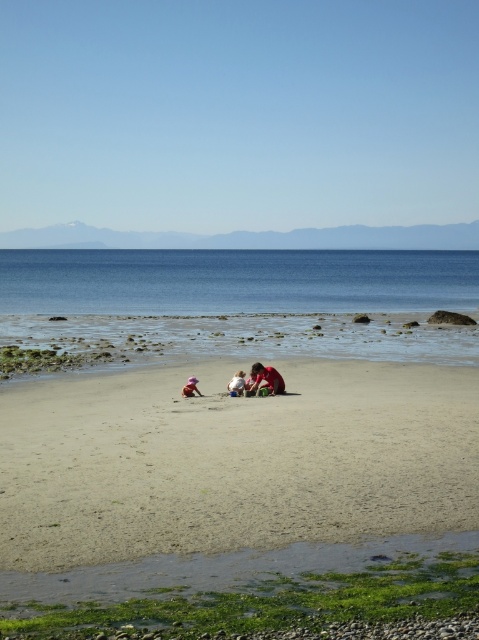
Between light brown sand at center and matte red shirt at center, which one appears on the left side from the viewer's perspective?

From the viewer's perspective, light brown sand at center appears more on the left side.

Image resolution: width=479 pixels, height=640 pixels. What do you see at coordinates (232, 460) in the screenshot? I see `light brown sand at center` at bounding box center [232, 460].

This screenshot has height=640, width=479. Find the location of `light brown sand at center`. light brown sand at center is located at coordinates pos(232,460).

Consider the image. Does light brown sand at center lie behind blue smooth water at center?

No, light brown sand at center is closer to the viewer.

Is point (144, 504) farther from viewer compared to point (409, 257)?

No, it is not.

I want to click on light brown sand at center, so click(232, 460).

Which is more to the left, blue smooth water at center or pink fabric at center?

From the viewer's perspective, pink fabric at center appears more on the left side.

Is blue smooth water at center above pink fabric at center?

Yes.

What do you see at coordinates (235, 282) in the screenshot?
I see `blue smooth water at center` at bounding box center [235, 282].

Locate an element on the screen. The height and width of the screenshot is (640, 479). blue smooth water at center is located at coordinates (235, 282).